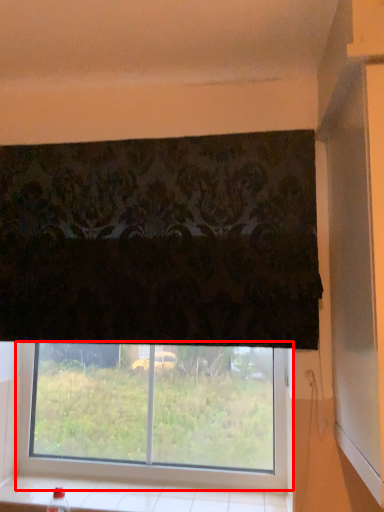
Question: In this image, where is window (annotated by the red box) located relative to window sill?

Choices:
 (A) right
 (B) left

Answer: (A)